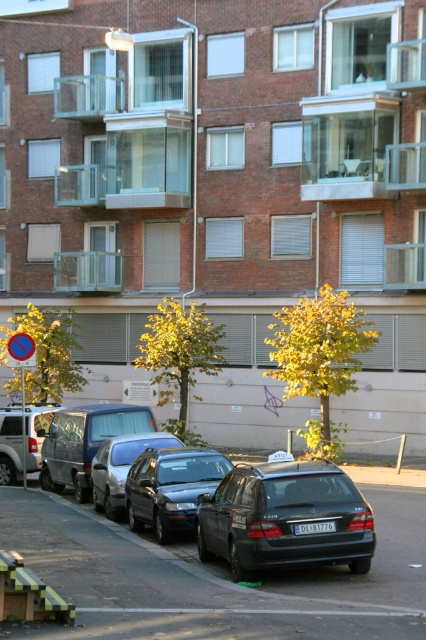
Is matte black station wagon at center above silver metallic van at left?

No, matte black station wagon at center is not above silver metallic van at left.

Identify the location of matte black station wagon at center. The image size is (426, 640). (284, 518).

Describe the element at coordinates (120, 467) in the screenshot. The width and height of the screenshot is (426, 640). I see `shiny silver sedan at center` at that location.

Based on the photo, is shiny silver sedan at center positioned at the back of silver metallic van at left?

No, it is not.

Describe the element at coordinates (120, 467) in the screenshot. This screenshot has width=426, height=640. I see `shiny silver sedan at center` at that location.

At what (x,y) coordinates should I click in order to perform the action: click on shiny silver sedan at center. Please return your answer as a coordinate pair (x, y). Looking at the image, I should click on (120, 467).

Is matte black station wagon at center to the left of black plastic license plate at center from the viewer's perspective?

Indeed, matte black station wagon at center is positioned on the left side of black plastic license plate at center.

Is matte black station wagon at center positioned in front of black plastic license plate at center?

Yes.

Locate an element on the screen. matte black station wagon at center is located at coordinates (284, 518).